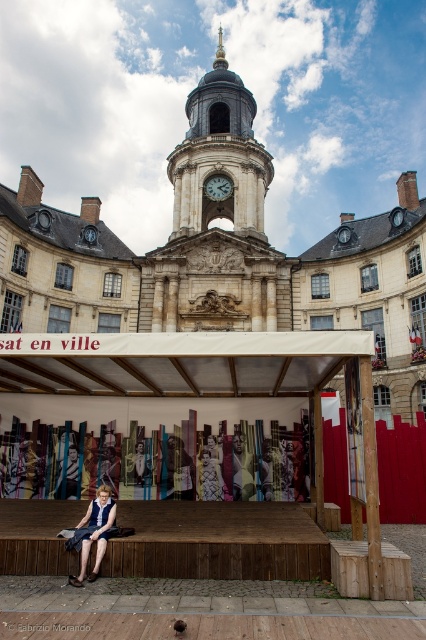
You are a costume designer who needs to know the relative sizes of the items in the scene. Which object is wider, the matte black dress at center or the brass clock face at upper center?

The brass clock face at upper center is wider than the matte black dress at center.

You are standing at the point marked as point (138, 456) in front of the grand historic building with a clock tower. You want to take a photo of the building using a camera that has a maximum zoom range of 50 meters. Will the camera be able to capture the entire building in the photo without needing to move closer?

The distance between point (138, 456) and the camera is 51.76 meters, which exceeds the camera maximum zoom range of 50 meters. Therefore, the camera cannot capture the entire building without moving closer.